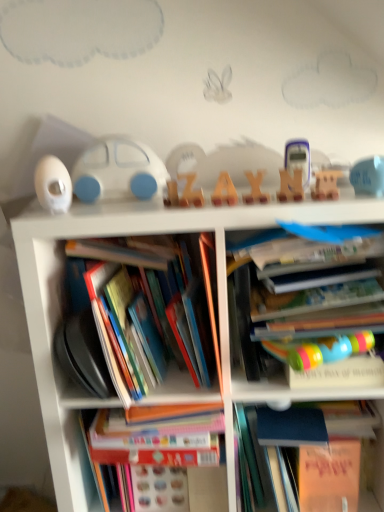
Measure the distance between hardcover book at center, which ranks as the 3th book in right-to-left order, and camera.

They are 32.93 inches apart.

What is the approximate width of hardcover book at upper right, the third book from the left?

The width of hardcover book at upper right, the third book from the left, is 17.29 inches.

Where is `white matte toy car at center`? white matte toy car at center is located at coordinates (118, 170).

Locate an element on the screen. wooden letter at center, the second toy from the right is located at coordinates (326, 185).

How much space does blue matte book at right, which appears as the 1th book when viewed from the right, occupy vertically?

blue matte book at right, which appears as the 1th book when viewed from the right, is 11.25 inches tall.

You are a GUI agent. You are given a task and a screenshot of the screen. Output one action in this format:
    pyautogui.click(x=<x>, y=<y>)
    Task: Click on the white plastic bookcase at center
    Image resolution: width=384 pixels, height=512 pixels.
    Given the screenshot: What is the action you would take?
    point(112,234)

From a real-world perspective, which object stands above the other?

From a 3D spatial view, white matte toy car at center is above.

Is hardcover book at center, which is counted as the second book, starting from the left, oriented towards white matte toy car at center?

No, hardcover book at center, which is counted as the second book, starting from the left, is not oriented towards white matte toy car at center.

Can you confirm if hardcover book at center, which ranks as the 3th book in right-to-left order, is smaller than white matte toy car at center?

No.

Which is more to the left, hardcover book at center, which ranks as the 3th book in right-to-left order, or white matte toy car at center?

Positioned to the left is white matte toy car at center.

Considering the sizes of wooden letter at center, arranged as the 4th toy when viewed from the right, and blue rubber duck at upper right, which is the 1th toy in right-to-left order, in the image, is wooden letter at center, arranged as the 4th toy when viewed from the right, wider or thinner than blue rubber duck at upper right, which is the 1th toy in right-to-left order,?

wooden letter at center, arranged as the 4th toy when viewed from the right, is thinner than blue rubber duck at upper right, which is the 1th toy in right-to-left order.

How many degrees apart are the facing directions of wooden letter at center, arranged as the 4th toy when viewed from the right, and blue rubber duck at upper right, which is the 1th toy in right-to-left order?

The angular difference between wooden letter at center, arranged as the 4th toy when viewed from the right, and blue rubber duck at upper right, which is the 1th toy in right-to-left order, is 25 degrees.

In the image, is wooden letter at center, arranged as the 4th toy when viewed from the right, on the left side or the right side of blue rubber duck at upper right, which is the 1th toy in right-to-left order?

wooden letter at center, arranged as the 4th toy when viewed from the right, is positioned on blue rubber duck at upper right, which is the 1th toy in right-to-left order,'s left side.

Considering the sizes of objects wooden letter at center, which ranks as the 2th toy in left-to-right order, and blue rubber duck at upper right, the 5th toy when ordered from left to right, in the image provided, who is taller, wooden letter at center, which ranks as the 2th toy in left-to-right order, or blue rubber duck at upper right, the 5th toy when ordered from left to right,?

With more height is blue rubber duck at upper right, the 5th toy when ordered from left to right.

In the scene shown: Which of these two, blue rubber duck at upper right, which is the 1th toy in right-to-left order, or hardcover book at left, the 4th book positioned from the right, is bigger?

With larger size is hardcover book at left, the 4th book positioned from the right.

From the picture: Measure the distance from blue rubber duck at upper right, the 5th toy when ordered from left to right, to hardcover book at left, the 4th book positioned from the right.

19.19 inches.

How different are the orientations of blue rubber duck at upper right, which is the 1th toy in right-to-left order, and hardcover book at left, the 4th book positioned from the right, in degrees?

The angle between the facing direction of blue rubber duck at upper right, which is the 1th toy in right-to-left order, and the facing direction of hardcover book at left, the 4th book positioned from the right, is 23.7 degrees.

Is blue rubber duck at upper right, the 5th toy when ordered from left to right, placed right next to hardcover book at left, the 4th book positioned from the right?

blue rubber duck at upper right, the 5th toy when ordered from left to right, and hardcover book at left, the 4th book positioned from the right, are clearly separated.

Is wooden letter at center, arranged as the 4th toy when viewed from the right, next to wooden letter at center, acting as the fourth toy starting from the left?

Yes.

Which point is more forward, (286, 197) or (326, 185)?

The point (286, 197) is closer.

Considering the sizes of objects wooden letter at center, arranged as the 4th toy when viewed from the right, and wooden letter at center, acting as the fourth toy starting from the left, in the image provided, who is wider, wooden letter at center, arranged as the 4th toy when viewed from the right, or wooden letter at center, acting as the fourth toy starting from the left,?

wooden letter at center, arranged as the 4th toy when viewed from the right, is wider.

From the image's perspective, between wooden letter at center, which ranks as the 2th toy in left-to-right order, and wooden letter at center, acting as the fourth toy starting from the left, which one is located above?

From the image's view, wooden letter at center, which ranks as the 2th toy in left-to-right order, is above.

Considering the relative sizes of hardcover book at upper right, which is the 2th book from right to left, and white matte car at left, marked as the fifth toy in a right-to-left arrangement, in the image provided, is hardcover book at upper right, which is the 2th book from right to left, wider than white matte car at left, marked as the fifth toy in a right-to-left arrangement,?

Correct, the width of hardcover book at upper right, which is the 2th book from right to left, exceeds that of white matte car at left, marked as the fifth toy in a right-to-left arrangement.

Looking at the image, does hardcover book at upper right, which is the 2th book from right to left, seem bigger or smaller compared to white matte car at left, which ranks as the 1th toy in left-to-right order?

Clearly, hardcover book at upper right, which is the 2th book from right to left, is larger in size than white matte car at left, which ranks as the 1th toy in left-to-right order.

Considering the relative sizes of hardcover book at upper right, the third book from the left, and white matte car at left, which ranks as the 1th toy in left-to-right order, in the image provided, is hardcover book at upper right, the third book from the left, taller than white matte car at left, which ranks as the 1th toy in left-to-right order,?

Correct, hardcover book at upper right, the third book from the left, is much taller as white matte car at left, which ranks as the 1th toy in left-to-right order.

Starting from the hardcover book at left, the 4th book positioned from the right, which book is the 1st one behind? Please provide its 2D coordinates.

[(153, 440)]

From the image's perspective, is hardcover book at center, which ranks as the 3th book in right-to-left order, located above or below hardcover book at left, which appears as the first book when viewed from the left?

hardcover book at center, which ranks as the 3th book in right-to-left order, is below hardcover book at left, which appears as the first book when viewed from the left.

Is the surface of hardcover book at center, which ranks as the 3th book in right-to-left order, in direct contact with hardcover book at left, the 4th book positioned from the right?

No, hardcover book at center, which ranks as the 3th book in right-to-left order, is not making contact with hardcover book at left, the 4th book positioned from the right.

Is translucent plastic calculator at center, positioned as the 3th toy in left-to-right order, next to wooden letter at center, arranged as the 4th toy when viewed from the right, and touching it?

Yes, translucent plastic calculator at center, positioned as the 3th toy in left-to-right order, is touching wooden letter at center, arranged as the 4th toy when viewed from the right.

In the image, is translucent plastic calculator at center, positioned as the 3th toy in left-to-right order, on the left side or the right side of wooden letter at center, which ranks as the 2th toy in left-to-right order?

In the image, translucent plastic calculator at center, positioned as the 3th toy in left-to-right order, appears on the right side of wooden letter at center, which ranks as the 2th toy in left-to-right order.

Can you confirm if translucent plastic calculator at center, positioned as the 3th toy in left-to-right order, is bigger than wooden letter at center, which ranks as the 2th toy in left-to-right order?

Yes, translucent plastic calculator at center, positioned as the 3th toy in left-to-right order, is bigger than wooden letter at center, which ranks as the 2th toy in left-to-right order.

From the white matte toy car at center, count 2nd book to the right and point to it. Please provide its 2D coordinates.

[(153, 440)]

From the image's perspective, count 2nd toys downward from the blue rubber duck at upper right, the 5th toy when ordered from left to right, and point to it. Please provide its 2D coordinates.

[(290, 186)]

From the image, which object appears to be nearer to white matte car at left, marked as the fifth toy in a right-to-left arrangement, hardcover book at center, which is counted as the second book, starting from the left, or blue matte book at right, positioned as the 4th book in left-to-right order?

The object closer to white matte car at left, marked as the fifth toy in a right-to-left arrangement, is hardcover book at center, which is counted as the second book, starting from the left.

When comparing their distances from hardcover book at left, the 4th book positioned from the right, does white matte car at left, marked as the fifth toy in a right-to-left arrangement, or hardcover book at upper right, which is the 2th book from right to left, seem further?

white matte car at left, marked as the fifth toy in a right-to-left arrangement, is positioned further to the anchor hardcover book at left, the 4th book positioned from the right.

Looking at the image, which one is located closer to white matte toy car at center, blue rubber duck at upper right, which is the 1th toy in right-to-left order, or blue matte book at right, which appears as the 1th book when viewed from the right?

Based on the image, blue rubber duck at upper right, which is the 1th toy in right-to-left order, appears to be nearer to white matte toy car at center.

Estimate the real-world distances between objects in this image. Which object is closer to hardcover book at center, which ranks as the 3th book in right-to-left order, wooden letter at center, arranged as the 4th toy when viewed from the right, or blue rubber duck at upper right, the 5th toy when ordered from left to right?

Based on the image, wooden letter at center, arranged as the 4th toy when viewed from the right, appears to be nearer to hardcover book at center, which ranks as the 3th book in right-to-left order.

Based on the photo, considering their positions, is white matte toy car at center positioned further to hardcover book at left, the 4th book positioned from the right, than white plastic bookcase at center?

white matte toy car at center is further to hardcover book at left, the 4th book positioned from the right.

From the image, which object appears to be nearer to hardcover book at upper right, the third book from the left, white plastic bookcase at center or wooden letter at center, the second toy from the right?

white plastic bookcase at center.

Looking at the image, which one is located further to white matte car at left, marked as the fifth toy in a right-to-left arrangement, translucent plastic calculator at center, which is counted as the 3th toy, starting from the right, or hardcover book at left, the 4th book positioned from the right?

translucent plastic calculator at center, which is counted as the 3th toy, starting from the right, is positioned further to the anchor white matte car at left, marked as the fifth toy in a right-to-left arrangement.

Estimate the real-world distances between objects in this image. Which object is further from blue matte book at right, positioned as the 4th book in left-to-right order, blue rubber duck at upper right, which is the 1th toy in right-to-left order, or wooden letter at center, which ranks as the 2th toy in left-to-right order?

Among the two, wooden letter at center, which ranks as the 2th toy in left-to-right order, is located further to blue matte book at right, positioned as the 4th book in left-to-right order.

At what (x,y) coordinates should I click in order to perform the action: click on book between hardcover book at left, which appears as the first book when viewed from the left, and hardcover book at upper right, which is the 2th book from right to left. Please return your answer as a coordinate pair (x, y). Looking at the image, I should click on (153, 440).

Locate an element on the screen. The height and width of the screenshot is (512, 384). toy car between white matte car at left, marked as the fifth toy in a right-to-left arrangement, and blue rubber duck at upper right, the 5th toy when ordered from left to right is located at coordinates (118, 170).

I want to click on bookcase between wooden letter at center, which ranks as the 2th toy in left-to-right order, and hardcover book at center, which is counted as the second book, starting from the left, in the vertical direction, so click(x=112, y=234).

The width and height of the screenshot is (384, 512). I want to click on bookcase between wooden letter at center, the second toy from the right, and hardcover book at center, which ranks as the 3th book in right-to-left order, from top to bottom, so [x=112, y=234].